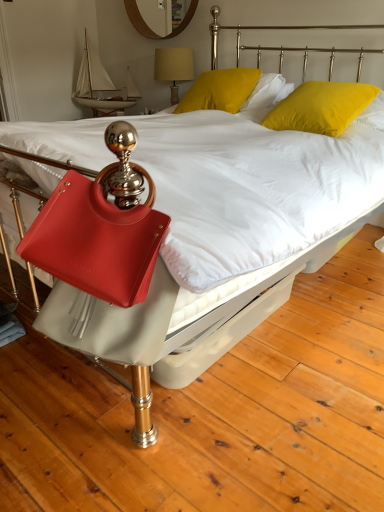
Question: Is matte yellow lampshade at upper center wider or thinner than wooden mirror at upper center?

Choices:
 (A) wide
 (B) thin

Answer: (A)

Question: Considering the positions of matte yellow lampshade at upper center and wooden mirror at upper center in the image, is matte yellow lampshade at upper center taller or shorter than wooden mirror at upper center?

Choices:
 (A) tall
 (B) short

Answer: (A)

Question: Which object is positioned closest to the matte yellow lampshade at upper center?

Choices:
 (A) yellow matte pillow at upper center, marked as the 2th pillow in a right-to-left arrangement
 (B) wooden mirror at upper center
 (C) yellow velvet pillow at upper right, placed as the 2th pillow when sorted from left to right
 (D) satin red handbag at lower left

Answer: (B)

Question: Considering the real-world distances, which object is farthest from the matte yellow lampshade at upper center?

Choices:
 (A) yellow velvet pillow at upper right, the first pillow in the right-to-left sequence
 (B) satin red handbag at lower left
 (C) wooden mirror at upper center
 (D) yellow matte pillow at upper center, marked as the 2th pillow in a right-to-left arrangement

Answer: (B)